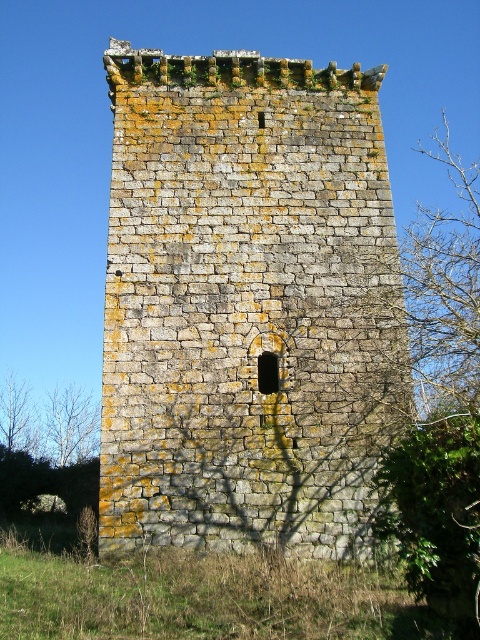
You are a bird flying over the landscape and want to land on the weathered stone tower at center. From your current position above the bare branches at left, which direction should you fly to reach the tower?

The weathered stone tower at center is located above the bare branches at left, so you should fly upward to reach the tower from your current position above the bare branches at left.

You are standing at the base of the weathered stone tower at center and looking towards the brown leafy tree at lower left. Which object appears taller from your vantage point?

The weathered stone tower at center appears taller than the brown leafy tree at lower left from your vantage point because the weathered stone tower at center is taller than brown leafy tree at lower left according to the description.

You are standing at the base of the tower and notice two points marked on the tower. The first point is at coordinates point (x=269, y=124), and the second is at point (x=51, y=400). From your perspective, which point is closer to you?

Point (x=269, y=124) is in front of point (x=51, y=400), so the first point is closer to you.